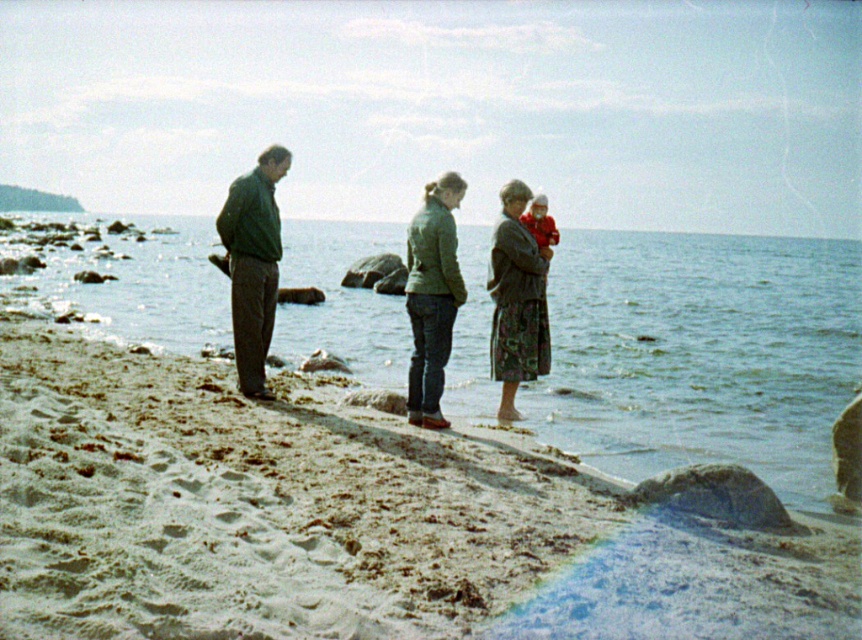
How much distance is there between sandy beach at lower left and green matte jacket at center?

The distance of sandy beach at lower left from green matte jacket at center is 1.76 meters.

Which is in front, point (500, 516) or point (453, 205)?

Point (500, 516)

Find the location of a particular element. The height and width of the screenshot is (640, 862). sandy beach at lower left is located at coordinates (347, 520).

Can you confirm if green matte jacket at left is positioned above green matte jacket at center?

Correct, green matte jacket at left is located above green matte jacket at center.

Who is more distant from viewer, (238, 189) or (456, 266)?

Point (238, 189)

Locate an element on the screen. green matte jacket at left is located at coordinates [x=253, y=262].

This screenshot has width=862, height=640. What do you see at coordinates (432, 296) in the screenshot? I see `green matte jacket at center` at bounding box center [432, 296].

Is green matte jacket at center taller than floral skirt at center?

Incorrect, green matte jacket at center's height is not larger of floral skirt at center's.

Does point (458, 188) come farther from viewer compared to point (498, 266)?

No, it is not.

Where is `green matte jacket at center`? The width and height of the screenshot is (862, 640). green matte jacket at center is located at coordinates (432, 296).